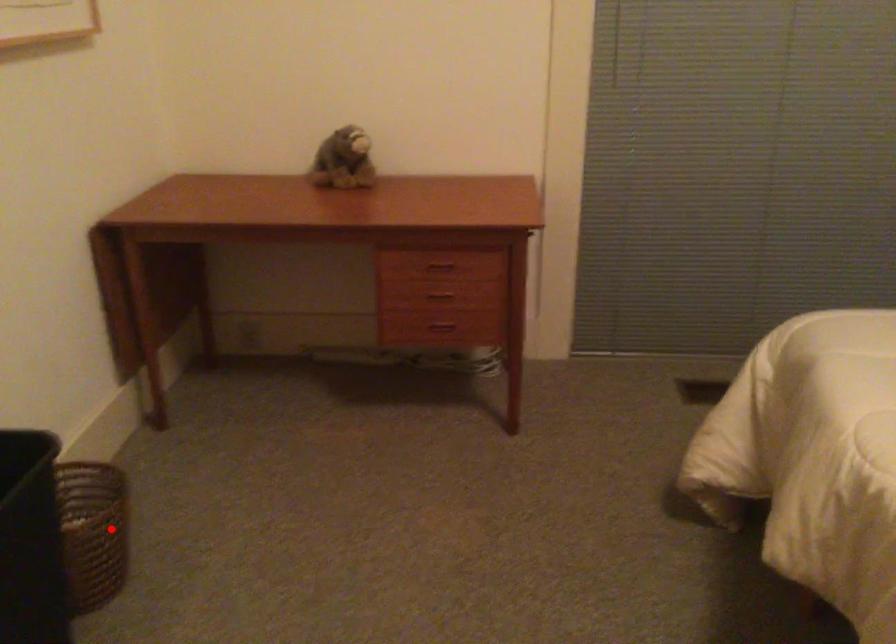
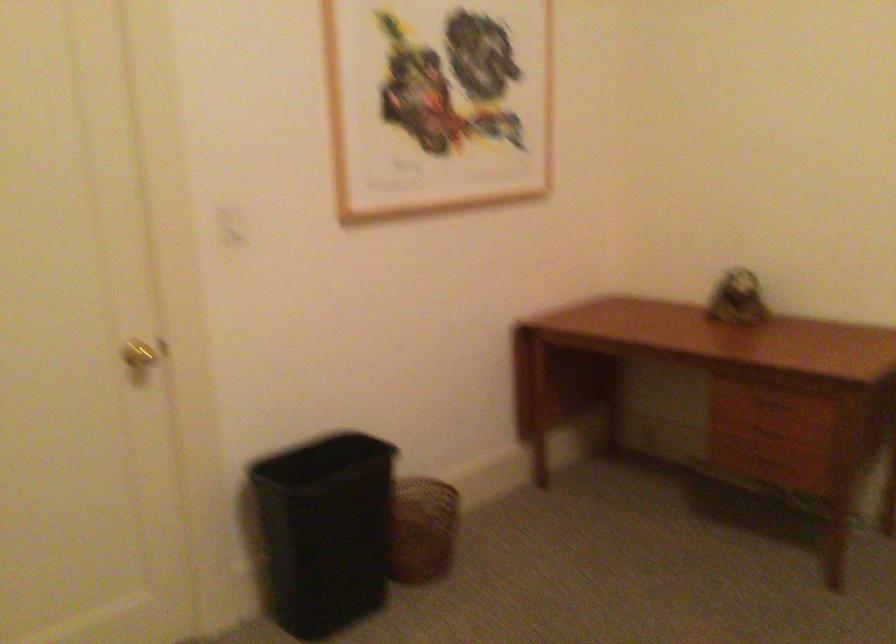
The point at the highlighted location is marked in the first image. Where is the corresponding point in the second image?

(423, 529)